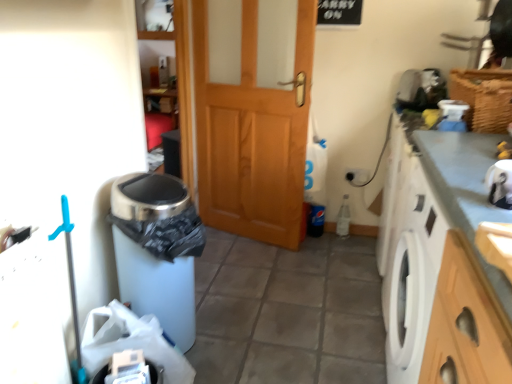
Question: Could white matte trash can at lower left be considered to be inside white plastic bag at lower left?

Choices:
 (A) no
 (B) yes

Answer: (A)

Question: Is white plastic bag at lower left oriented away from white matte trash can at lower left?

Choices:
 (A) yes
 (B) no

Answer: (B)

Question: Is the depth of white plastic bag at lower left greater than that of white matte trash can at lower left?

Choices:
 (A) no
 (B) yes

Answer: (A)

Question: Is white plastic bag at lower left placed right next to white matte trash can at lower left?

Choices:
 (A) yes
 (B) no

Answer: (B)

Question: Can you confirm if white plastic bag at lower left is positioned to the right of white matte trash can at lower left?

Choices:
 (A) yes
 (B) no

Answer: (B)

Question: From the image's perspective, is white plastic bag at lower left above white matte trash can at lower left?

Choices:
 (A) no
 (B) yes

Answer: (A)

Question: Can you confirm if smooth gray countertop at right is thinner than white matte trash can at lower left?

Choices:
 (A) yes
 (B) no

Answer: (A)

Question: Is smooth gray countertop at right turned away from white matte trash can at lower left?

Choices:
 (A) yes
 (B) no

Answer: (B)

Question: Is smooth gray countertop at right bigger than white matte trash can at lower left?

Choices:
 (A) no
 (B) yes

Answer: (B)

Question: Is smooth gray countertop at right further to the viewer compared to white matte trash can at lower left?

Choices:
 (A) no
 (B) yes

Answer: (A)

Question: Considering the relative sizes of smooth gray countertop at right and white matte trash can at lower left in the image provided, is smooth gray countertop at right shorter than white matte trash can at lower left?

Choices:
 (A) yes
 (B) no

Answer: (B)

Question: From a real-world perspective, is smooth gray countertop at right positioned over white matte trash can at lower left based on gravity?

Choices:
 (A) no
 (B) yes

Answer: (B)

Question: Is wooden door at center outside smooth gray countertop at right?

Choices:
 (A) no
 (B) yes

Answer: (B)